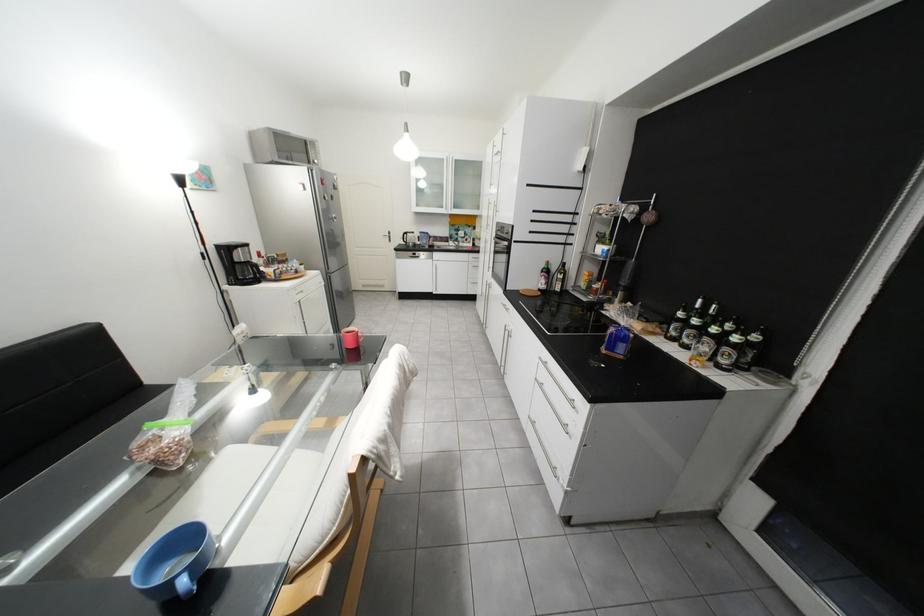
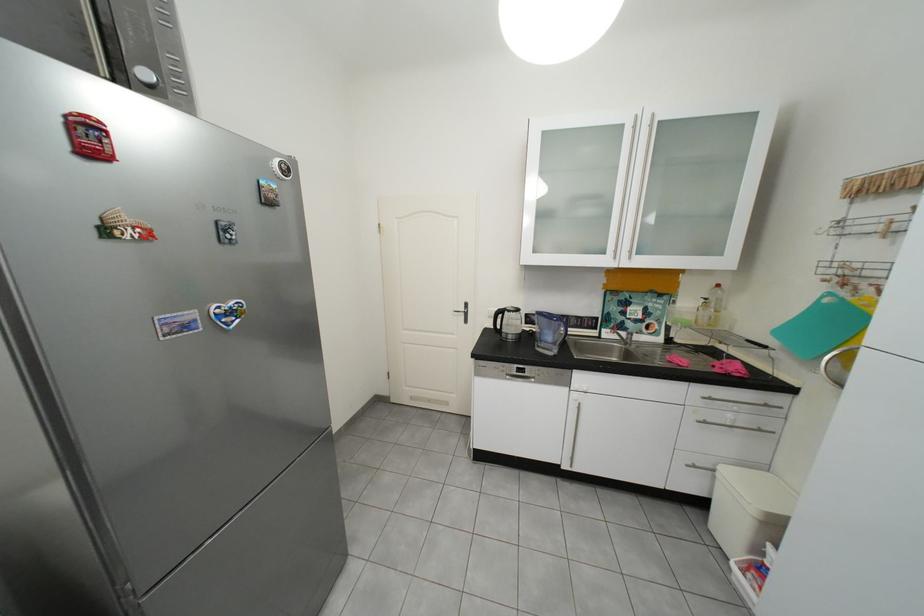
Question: What movement of the cameraman would produce the second image?

Choices:
 (A) Left
 (B) Right
 (C) Forward
 (D) Backward

Answer: (C)